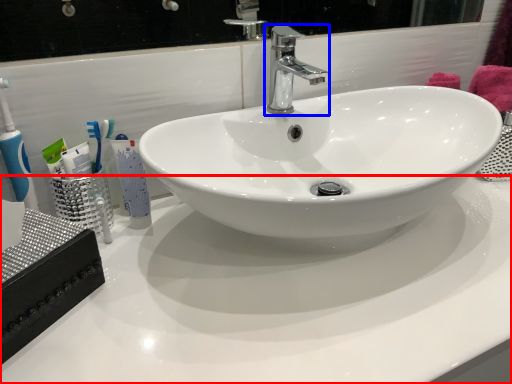
Question: Which point is further to the camera, counter top (highlighted by a red box) or tap (highlighted by a blue box)?

Choices:
 (A) counter top
 (B) tap

Answer: (B)